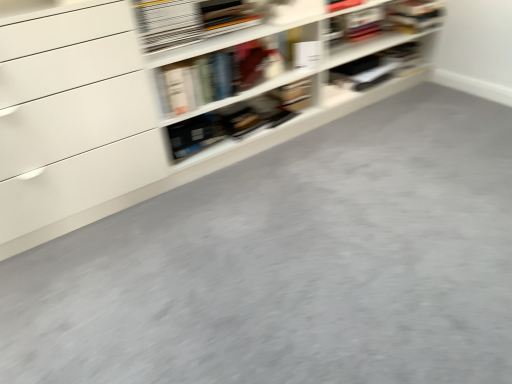
Question: From a real-world perspective, is matte black book at upper center, placed as the 2th book when sorted from left to right, on hardcover book at upper center, the second book positioned from the back?

Choices:
 (A) no
 (B) yes

Answer: (A)

Question: Can you confirm if matte black book at upper center, marked as the second book in a front-to-back arrangement, is smaller than hardcover book at upper center, the second book positioned from the back?

Choices:
 (A) no
 (B) yes

Answer: (A)

Question: From a real-world perspective, is matte black book at upper center, marked as the 1th book in a back-to-front arrangement, positioned under hardcover book at upper center, the second book positioned from the back, based on gravity?

Choices:
 (A) no
 (B) yes

Answer: (B)

Question: Does matte black book at upper center, marked as the 1th book in a back-to-front arrangement, appear on the right side of hardcover book at upper center, which is the first book from front to back?

Choices:
 (A) no
 (B) yes

Answer: (B)

Question: Is matte black book at upper center, marked as the second book in a front-to-back arrangement, touching hardcover book at upper center, the second book positioned from the back?

Choices:
 (A) yes
 (B) no

Answer: (B)

Question: Is matte black book at upper center, marked as the 1th book in a back-to-front arrangement, positioned beyond the bounds of hardcover book at upper center, which ranks as the 1th book in left-to-right order?

Choices:
 (A) yes
 (B) no

Answer: (A)

Question: Is hardcover book at upper center, which is the first book from front to back, oriented towards matte black book at upper center, marked as the 1th book in a back-to-front arrangement?

Choices:
 (A) yes
 (B) no

Answer: (B)

Question: Is hardcover book at upper center, the 2th book viewed from the right, bigger than matte black book at upper center, marked as the second book in a front-to-back arrangement?

Choices:
 (A) no
 (B) yes

Answer: (A)

Question: Considering the relative sizes of hardcover book at upper center, which ranks as the 1th book in left-to-right order, and matte black book at upper center, which is the 1th book from right to left, in the image provided, is hardcover book at upper center, which ranks as the 1th book in left-to-right order, shorter than matte black book at upper center, which is the 1th book from right to left,?

Choices:
 (A) no
 (B) yes

Answer: (B)

Question: Is hardcover book at upper center, the second book positioned from the back, positioned before matte black book at upper center, marked as the 1th book in a back-to-front arrangement?

Choices:
 (A) yes
 (B) no

Answer: (A)

Question: From a real-world perspective, does hardcover book at upper center, the 2th book viewed from the right, stand above matte black book at upper center, marked as the second book in a front-to-back arrangement?

Choices:
 (A) no
 (B) yes

Answer: (B)

Question: Can you confirm if hardcover book at upper center, the 2th book viewed from the right, is taller than matte black book at upper center, marked as the 1th book in a back-to-front arrangement?

Choices:
 (A) yes
 (B) no

Answer: (B)

Question: Considering the relative positions of white matte shelf at upper center and matte black book at upper center, marked as the second book in a front-to-back arrangement, in the image provided, is white matte shelf at upper center to the left of matte black book at upper center, marked as the second book in a front-to-back arrangement, from the viewer's perspective?

Choices:
 (A) yes
 (B) no

Answer: (A)